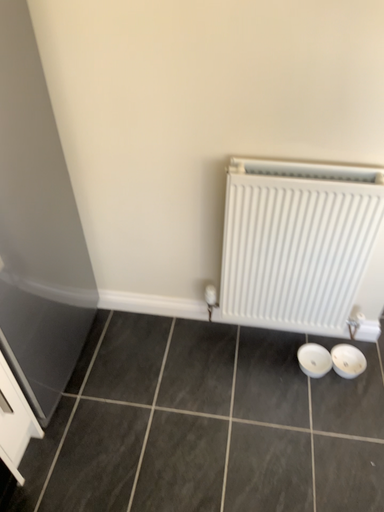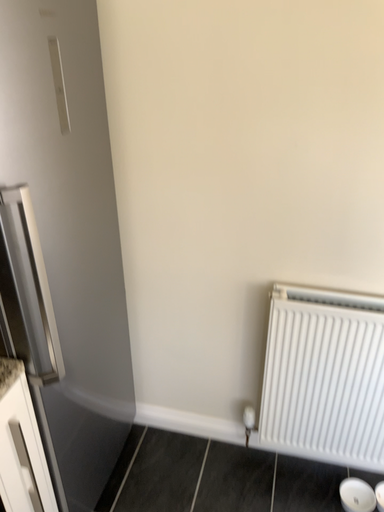
Question: Which way did the camera rotate in the video?

Choices:
 (A) rotated upward
 (B) rotated downward

Answer: (A)